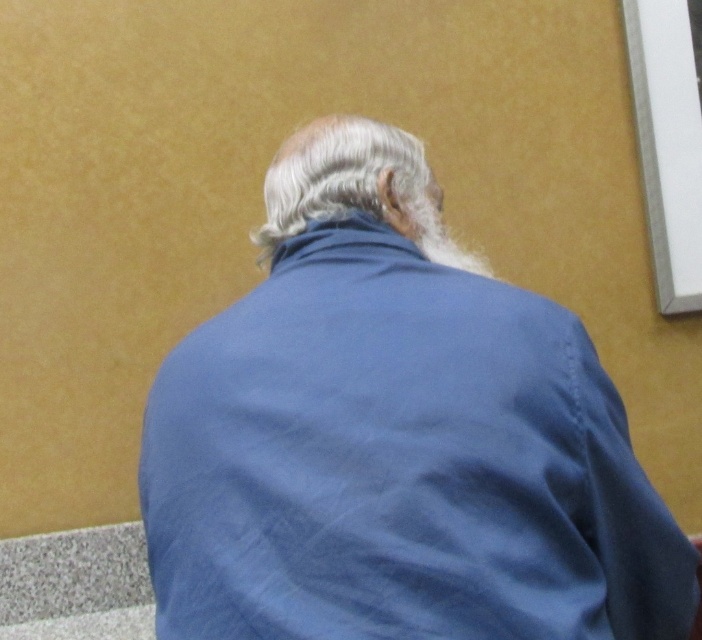
Question: Can you confirm if blue fabric jacket at center is wider than white matte hair at center?

Choices:
 (A) yes
 (B) no

Answer: (A)

Question: Which point is closer to the camera taking this photo?

Choices:
 (A) (310, 220)
 (B) (291, 456)

Answer: (B)

Question: Can you confirm if blue fabric jacket at center is positioned to the left of white matte hair at center?

Choices:
 (A) no
 (B) yes

Answer: (A)

Question: Does blue fabric jacket at center appear over white matte hair at center?

Choices:
 (A) no
 (B) yes

Answer: (A)